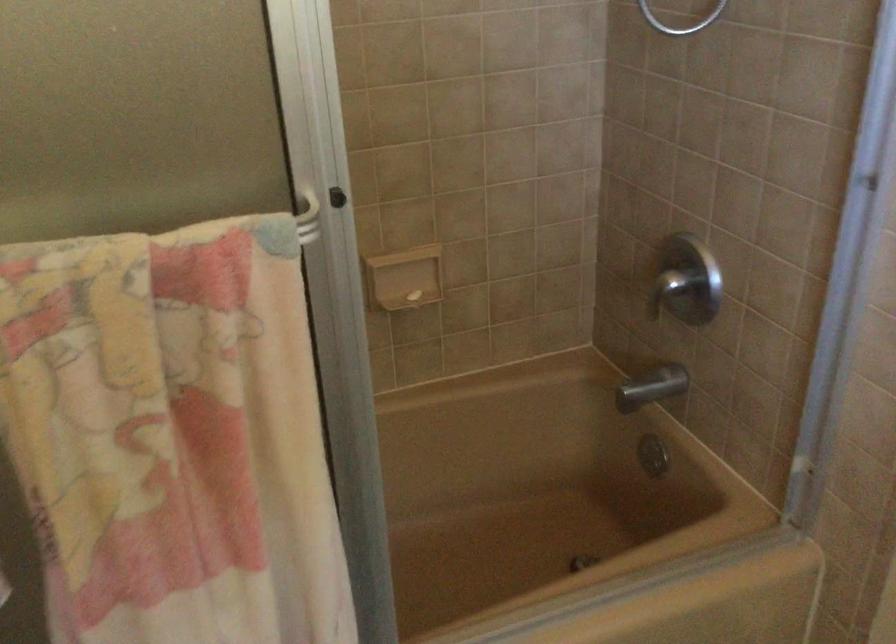
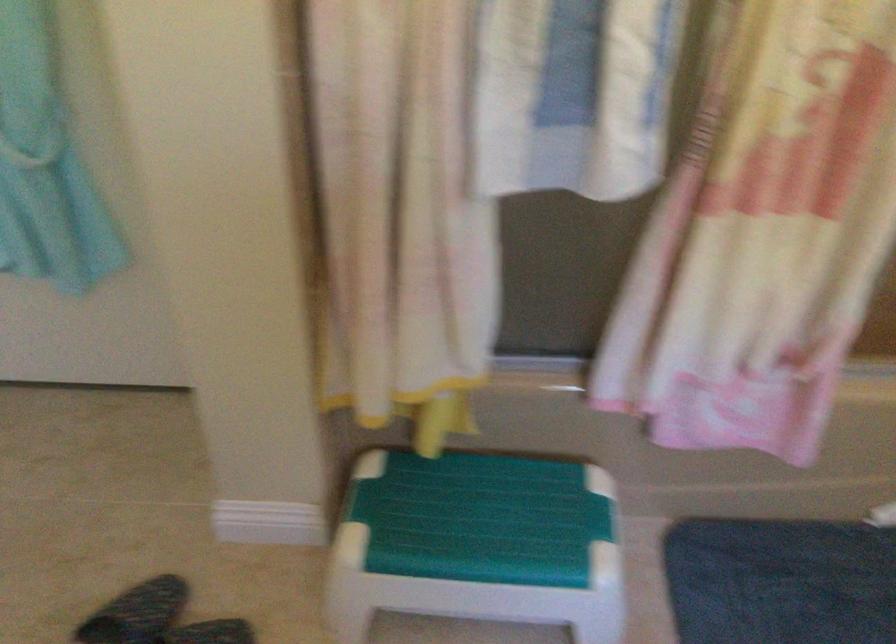
Question: How did the camera likely rotate?

Choices:
 (A) Left
 (B) Right
 (C) Up
 (D) Down

Answer: (A)